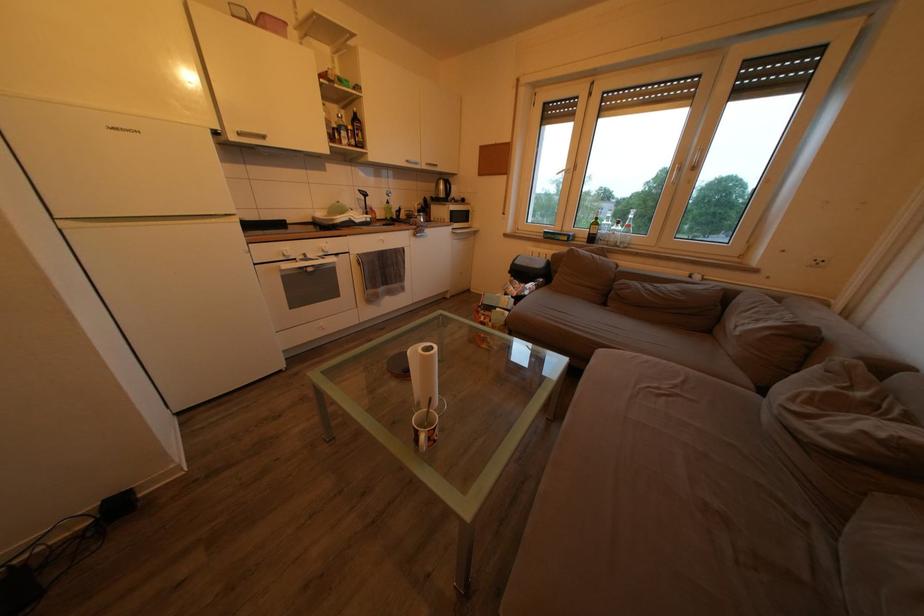
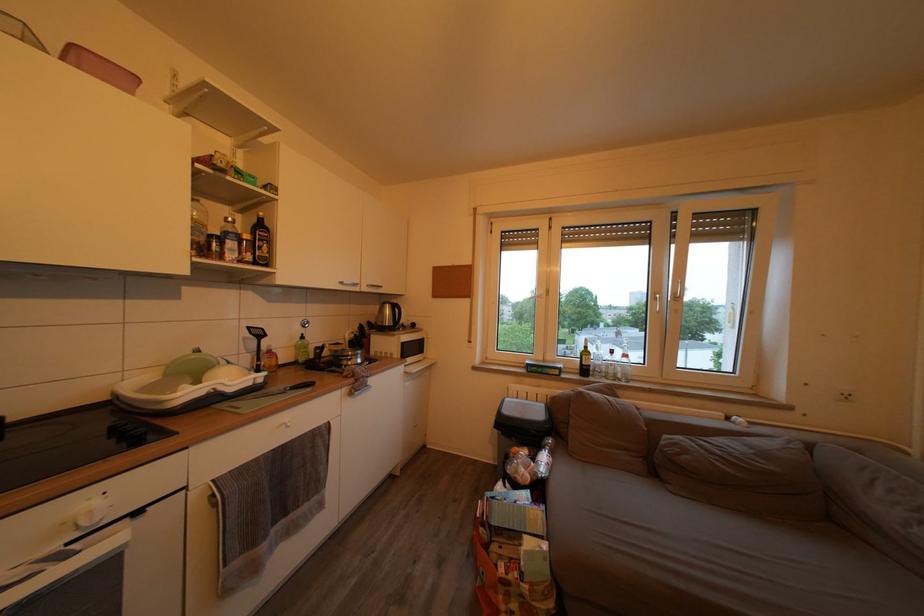
Where in the second image is the point corresponding to pixel 358 132 from the first image?

(253, 243)